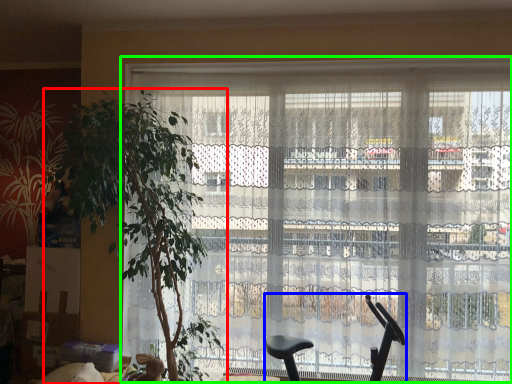
Question: Estimate the real-world distances between objects in this image. Which object is closer to houseplant (highlighted by a red box), baby carriage (highlighted by a blue box) or window (highlighted by a green box)?

Choices:
 (A) baby carriage
 (B) window

Answer: (B)